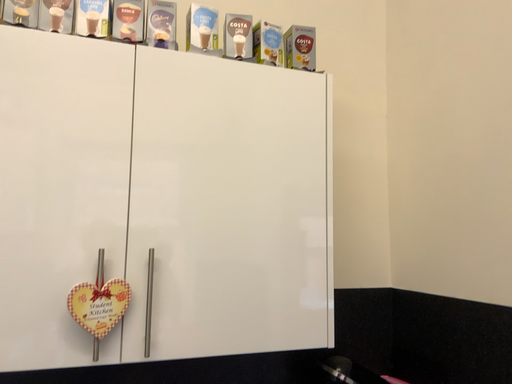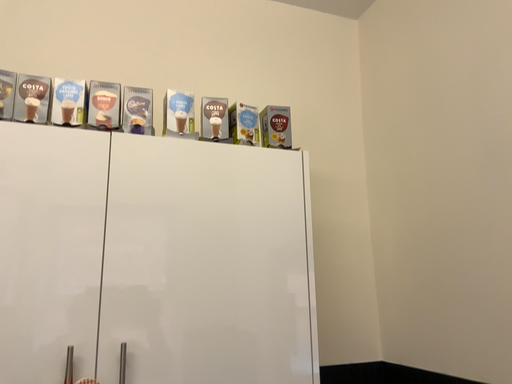
Question: How did the camera likely rotate when shooting the video?

Choices:
 (A) rotated downward
 (B) rotated upward

Answer: (B)